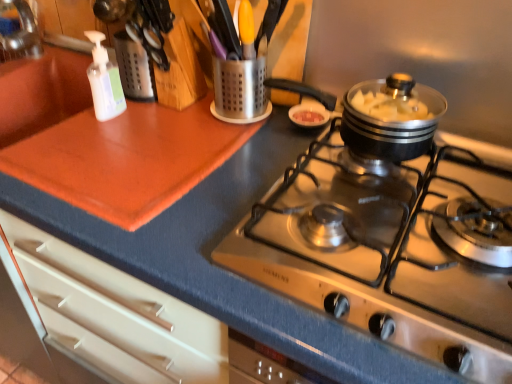
Question: Does stainless steel cooktop at center turn towards white translucent bottle at upper left?

Choices:
 (A) no
 (B) yes

Answer: (A)

Question: Does stainless steel cooktop at center come in front of white translucent bottle at upper left?

Choices:
 (A) no
 (B) yes

Answer: (B)

Question: Is stainless steel cooktop at center thinner than white translucent bottle at upper left?

Choices:
 (A) yes
 (B) no

Answer: (B)

Question: From the image's perspective, would you say stainless steel cooktop at center is positioned over white translucent bottle at upper left?

Choices:
 (A) yes
 (B) no

Answer: (B)

Question: Is stainless steel cooktop at center to the left of white translucent bottle at upper left from the viewer's perspective?

Choices:
 (A) yes
 (B) no

Answer: (B)

Question: Is metallic utensil holder at upper center taller or shorter than white translucent bottle at upper left?

Choices:
 (A) tall
 (B) short

Answer: (B)

Question: Is metallic utensil holder at upper center wider or thinner than white translucent bottle at upper left?

Choices:
 (A) wide
 (B) thin

Answer: (A)

Question: In the image, is metallic utensil holder at upper center on the left side or the right side of white translucent bottle at upper left?

Choices:
 (A) right
 (B) left

Answer: (A)

Question: Considering the positions of point (253, 36) and point (89, 36), is point (253, 36) closer or farther from the camera than point (89, 36)?

Choices:
 (A) farther
 (B) closer

Answer: (B)

Question: Is white translucent bottle at upper left spatially inside stainless steel cooktop at center, or outside of it?

Choices:
 (A) outside
 (B) inside

Answer: (A)

Question: In the image, is white translucent bottle at upper left on the left side or the right side of stainless steel cooktop at center?

Choices:
 (A) right
 (B) left

Answer: (B)

Question: From their relative heights in the image, would you say white translucent bottle at upper left is taller or shorter than stainless steel cooktop at center?

Choices:
 (A) short
 (B) tall

Answer: (B)

Question: From the image's perspective, is white translucent bottle at upper left located above or below stainless steel cooktop at center?

Choices:
 (A) below
 (B) above

Answer: (B)

Question: From the image's perspective, is stainless steel cooktop at center positioned above or below white translucent bottle at upper left?

Choices:
 (A) above
 (B) below

Answer: (B)

Question: Considering the positions of stainless steel cooktop at center and white translucent bottle at upper left in the image, is stainless steel cooktop at center wider or thinner than white translucent bottle at upper left?

Choices:
 (A) wide
 (B) thin

Answer: (A)